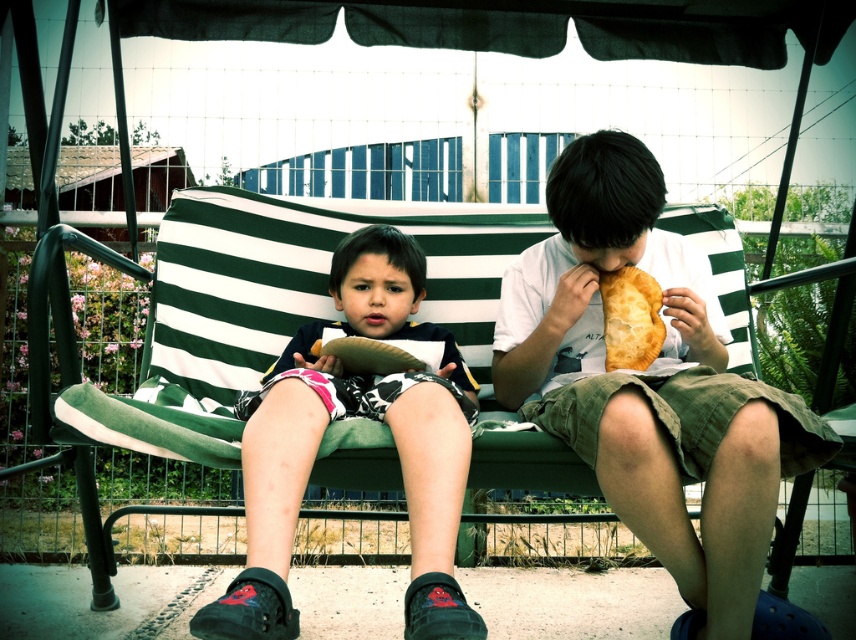
Question: Estimate the real-world distances between objects in this image. Which object is farther from the golden flaky pie at center?

Choices:
 (A) matte white shirt at center
 (B) green striped cushion at center
 (C) black suede shoes at lower center

Answer: (B)

Question: Can you confirm if matte white shirt at center is positioned below black suede shoes at lower center?

Choices:
 (A) no
 (B) yes

Answer: (A)

Question: Estimate the real-world distances between objects in this image. Which object is closer to the golden flaky pie at center?

Choices:
 (A) green striped cushion at center
 (B) black suede shoes at lower center

Answer: (B)

Question: Can you confirm if matte white shirt at center is positioned below green striped cushion at center?

Choices:
 (A) yes
 (B) no

Answer: (A)

Question: Which of the following is the farthest from the observer?

Choices:
 (A) matte white shirt at center
 (B) golden flaky pie at center

Answer: (B)

Question: In this image, where is matte white shirt at center located relative to golden flaky pie at center?

Choices:
 (A) right
 (B) left

Answer: (A)